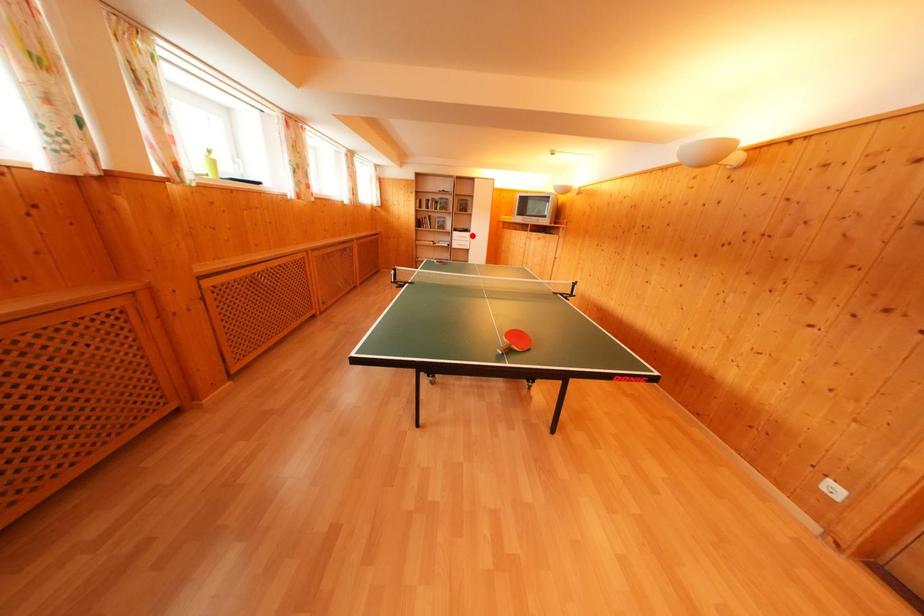
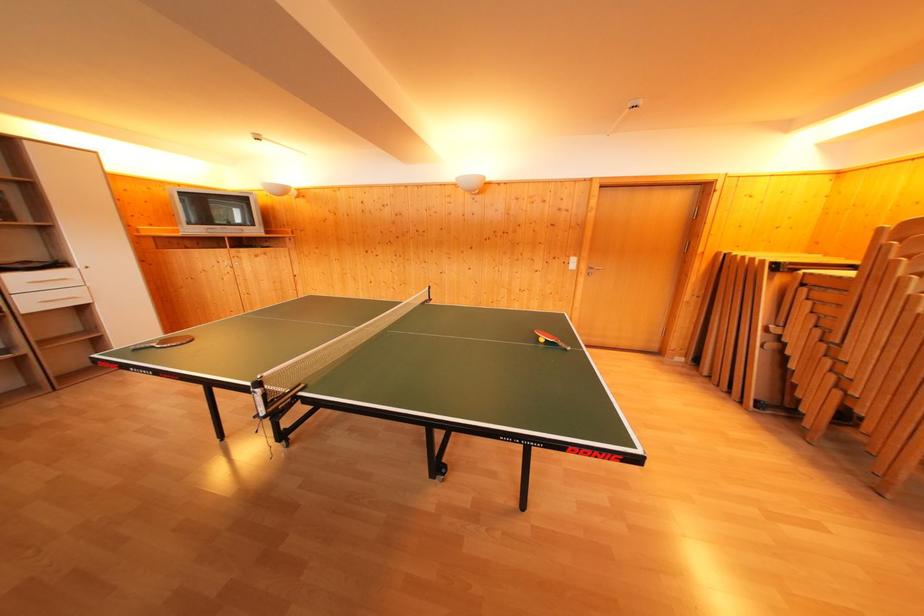
Question: I am providing you with two images of the same scene from different viewpoints. Image1 has a red point marked. In image2, the corresponding 3D location appears at what relative position? Reply with the corresponding letter.

Choices:
 (A) Closer
 (B) Farther

Answer: (B)